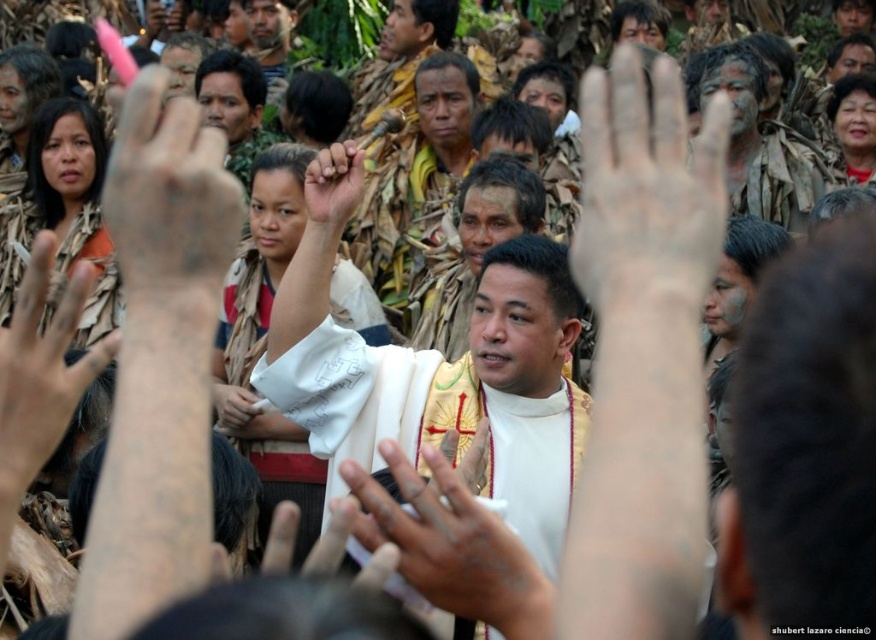
You are a photographer at the event and want to capture a closeup of the dry skin palm at center and the dirty face paint at center. Which one should you focus on first if you want to ensure both are in focus without moving the camera?

The dry skin palm at center is below dirty face paint at center, so you should focus on the dry skin palm at center first since it is closer to the camera.

Looking at this image, you are an observer at the gathering and notice the white matte hand at center and the dirty face paint at center. Which object is closer to you?

The white matte hand at center is closer to you because it is in front of the dirty face paint at center.

You are an observer at the event and notice two hands in the scene. The first is the white matte hand at center, and the second is the brown textured hand at left. Which hand appears closer to the ground?

The white matte hand at center has a lesser height compared to the brown textured hand at left, so it appears closer to the ground.